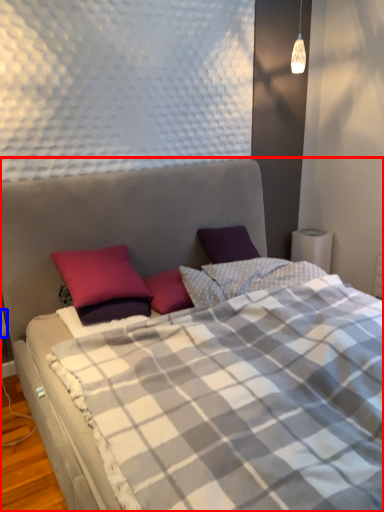
Question: Which object appears closest to the camera in this image, bed (highlighted by a red box) or electric outlet (highlighted by a blue box)?

Choices:
 (A) bed
 (B) electric outlet

Answer: (A)